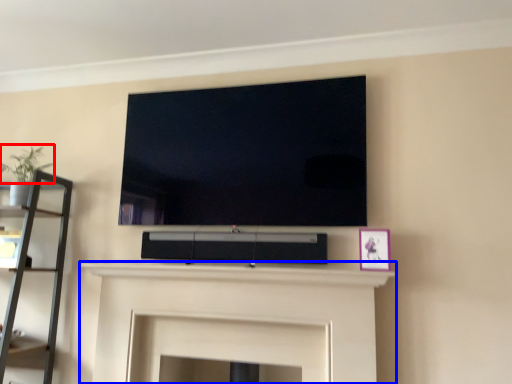
Question: Which of the following is the closest to the observer, plant (highlighted by a red box) or fireplace (highlighted by a blue box)?

Choices:
 (A) plant
 (B) fireplace

Answer: (B)